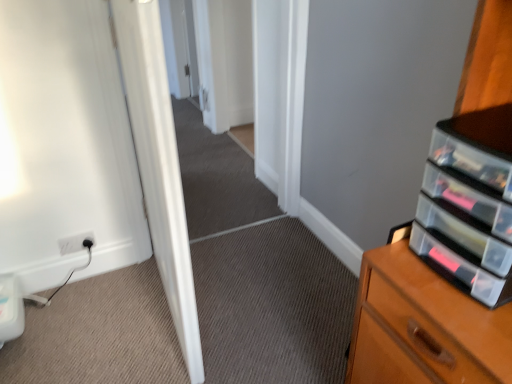
Question: Should I look upward or downward to see white glossy door at center?

Choices:
 (A) up
 (B) down

Answer: (A)

Question: Is white plastic electric outlet at lower left turned away from white glossy door at center?

Choices:
 (A) no
 (B) yes

Answer: (A)

Question: From a real-world perspective, is white plastic electric outlet at lower left on top of white glossy door at center?

Choices:
 (A) no
 (B) yes

Answer: (A)

Question: From the image's perspective, would you say white plastic electric outlet at lower left is shown under white glossy door at center?

Choices:
 (A) no
 (B) yes

Answer: (B)

Question: Is white plastic electric outlet at lower left not close to white glossy door at center?

Choices:
 (A) no
 (B) yes

Answer: (A)

Question: From the image's perspective, is white plastic electric outlet at lower left over white glossy door at center?

Choices:
 (A) yes
 (B) no

Answer: (B)

Question: Is white plastic electric outlet at lower left smaller than white glossy door at center?

Choices:
 (A) yes
 (B) no

Answer: (A)

Question: From the image's perspective, would you say clear plastic drawers at right is shown under white plastic electric outlet at lower left?

Choices:
 (A) no
 (B) yes

Answer: (A)

Question: From the image's perspective, is clear plastic drawers at right over white plastic electric outlet at lower left?

Choices:
 (A) yes
 (B) no

Answer: (A)

Question: Considering the relative positions of clear plastic drawers at right and white plastic electric outlet at lower left in the image provided, is clear plastic drawers at right behind white plastic electric outlet at lower left?

Choices:
 (A) no
 (B) yes

Answer: (A)

Question: Can white plastic electric outlet at lower left be found inside clear plastic drawers at right?

Choices:
 (A) no
 (B) yes

Answer: (A)

Question: Does clear plastic drawers at right have a greater height compared to white plastic electric outlet at lower left?

Choices:
 (A) no
 (B) yes

Answer: (B)

Question: Can you confirm if clear plastic drawers at right is thinner than white plastic electric outlet at lower left?

Choices:
 (A) yes
 (B) no

Answer: (B)

Question: From the image's perspective, is white glossy door at center located above white plastic electric outlet at lower left?

Choices:
 (A) no
 (B) yes

Answer: (B)